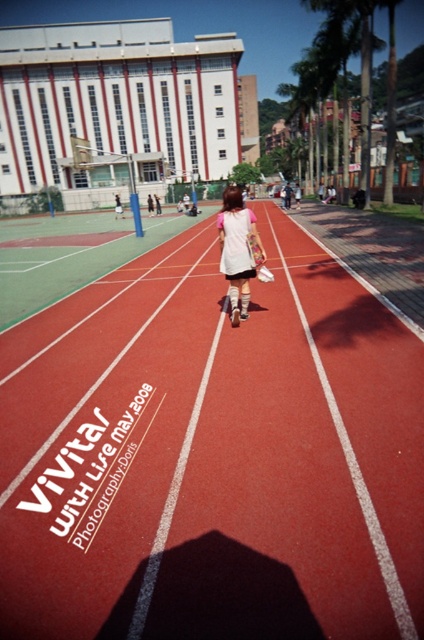
Question: Considering the real-world distances, which object is farthest from the white plastic tennis racket at center?

Choices:
 (A) rubber running track at center
 (B) matte pink shirt at center

Answer: (A)

Question: Among these points, which one is nearest to the camera?

Choices:
 (A) (125, 465)
 (B) (242, 260)

Answer: (A)

Question: Does white rubber finish line at center appear over white plastic tennis racket at center?

Choices:
 (A) yes
 (B) no

Answer: (B)

Question: Can you confirm if rubber running track at center is positioned below white rubber finish line at center?

Choices:
 (A) yes
 (B) no

Answer: (B)

Question: Is matte pink shirt at center below white plastic tennis racket at center?

Choices:
 (A) yes
 (B) no

Answer: (A)

Question: Which of the following is the farthest from the observer?

Choices:
 (A) white rubber finish line at center
 (B) rubber running track at center
 (C) white plastic tennis racket at center

Answer: (C)